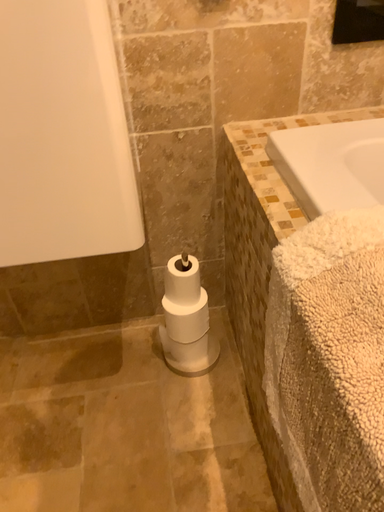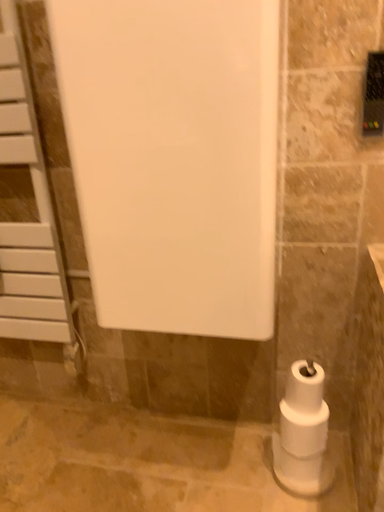
Question: Which way did the camera rotate in the video?

Choices:
 (A) rotated upward
 (B) rotated downward

Answer: (A)